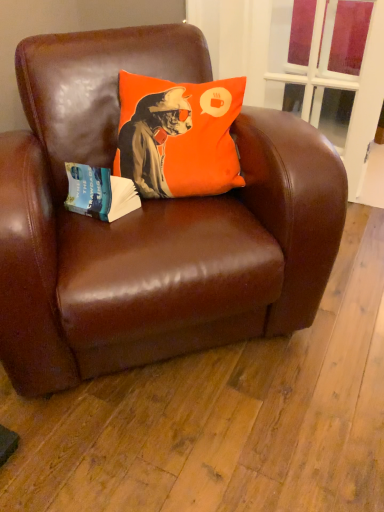
Question: Does blue paper at left have a lesser height compared to brown leather chair at center?

Choices:
 (A) no
 (B) yes

Answer: (B)

Question: Is blue paper at left at the right side of brown leather chair at center?

Choices:
 (A) yes
 (B) no

Answer: (B)

Question: Does blue paper at left have a smaller size compared to brown leather chair at center?

Choices:
 (A) yes
 (B) no

Answer: (A)

Question: Is blue paper at left behind brown leather chair at center?

Choices:
 (A) no
 (B) yes

Answer: (B)

Question: Can you confirm if blue paper at left is taller than brown leather chair at center?

Choices:
 (A) no
 (B) yes

Answer: (A)

Question: Is blue paper at left at the left side of brown leather chair at center?

Choices:
 (A) no
 (B) yes

Answer: (B)

Question: From a real-world perspective, does orange fabric pillow at upper center stand above blue paper at left?

Choices:
 (A) yes
 (B) no

Answer: (A)

Question: From a real-world perspective, is orange fabric pillow at upper center below blue paper at left?

Choices:
 (A) yes
 (B) no

Answer: (B)

Question: Does orange fabric pillow at upper center have a smaller size compared to blue paper at left?

Choices:
 (A) yes
 (B) no

Answer: (B)

Question: Is orange fabric pillow at upper center next to blue paper at left and touching it?

Choices:
 (A) yes
 (B) no

Answer: (B)

Question: From the image's perspective, is orange fabric pillow at upper center below blue paper at left?

Choices:
 (A) no
 (B) yes

Answer: (A)

Question: From the image's perspective, does orange fabric pillow at upper center appear higher than blue paper at left?

Choices:
 (A) no
 (B) yes

Answer: (B)

Question: Is brown leather chair at center smaller than transparent glass window at upper center?

Choices:
 (A) yes
 (B) no

Answer: (B)